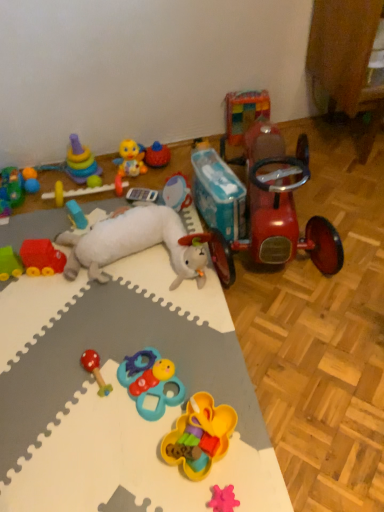
Locate an element on the screen. The height and width of the screenshot is (512, 384). vacant space to the left of rubberized yellow flower-shaped toy at center, the tenth toy in the left-to-right sequence is located at coordinates (132, 452).